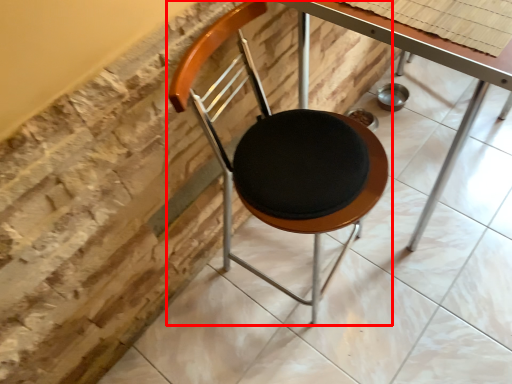
Question: Considering the relative positions of chair (annotated by the red box) and table in the image provided, where is chair (annotated by the red box) located with respect to the staircase?

Choices:
 (A) left
 (B) right

Answer: (A)